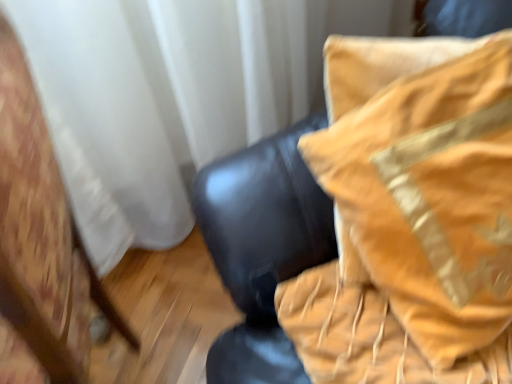
Question: Considering the relative positions of velvet gold pillow at upper right, the first furniture from the right, and wooden chair at left, placed as the 1th furniture when sorted from left to right, in the image provided, is velvet gold pillow at upper right, the first furniture from the right, to the left of wooden chair at left, placed as the 1th furniture when sorted from left to right, from the viewer's perspective?

Choices:
 (A) no
 (B) yes

Answer: (A)

Question: Is velvet gold pillow at upper right, the 2th furniture when ordered from left to right, beside wooden chair at left, placed as the 1th furniture when sorted from left to right?

Choices:
 (A) no
 (B) yes

Answer: (A)

Question: From a real-world perspective, is velvet gold pillow at upper right, the first furniture from the right, on top of wooden chair at left, placed as the 1th furniture when sorted from left to right?

Choices:
 (A) yes
 (B) no

Answer: (A)

Question: Would you say velvet gold pillow at upper right, the first furniture from the right, is outside wooden chair at left, placed as the 1th furniture when sorted from left to right?

Choices:
 (A) yes
 (B) no

Answer: (A)

Question: Is velvet gold pillow at upper right, the first furniture from the right, positioned behind wooden chair at left, which is the 2th furniture in right-to-left order?

Choices:
 (A) yes
 (B) no

Answer: (A)

Question: From a real-world perspective, is velvet gold pillow at upper right, the first furniture from the right, located beneath wooden chair at left, placed as the 1th furniture when sorted from left to right?

Choices:
 (A) yes
 (B) no

Answer: (B)

Question: Is wooden chair at left, placed as the 1th furniture when sorted from left to right, at the left side of velvet gold pillow at upper right, the 2th furniture when ordered from left to right?

Choices:
 (A) yes
 (B) no

Answer: (A)

Question: Considering the relative sizes of wooden chair at left, which is the 2th furniture in right-to-left order, and velvet gold pillow at upper right, the 2th furniture when ordered from left to right, in the image provided, is wooden chair at left, which is the 2th furniture in right-to-left order, taller than velvet gold pillow at upper right, the 2th furniture when ordered from left to right,?

Choices:
 (A) no
 (B) yes

Answer: (B)

Question: Does wooden chair at left, placed as the 1th furniture when sorted from left to right, have a lesser height compared to velvet gold pillow at upper right, the 2th furniture when ordered from left to right?

Choices:
 (A) no
 (B) yes

Answer: (A)

Question: From a real-world perspective, is wooden chair at left, which is the 2th furniture in right-to-left order, positioned over velvet gold pillow at upper right, the first furniture from the right, based on gravity?

Choices:
 (A) yes
 (B) no

Answer: (B)

Question: From a real-world perspective, is wooden chair at left, which is the 2th furniture in right-to-left order, below velvet gold pillow at upper right, the first furniture from the right?

Choices:
 (A) yes
 (B) no

Answer: (A)

Question: Is velvet gold pillow at upper right, the first furniture from the right, located within wooden chair at left, which is the 2th furniture in right-to-left order?

Choices:
 (A) yes
 (B) no

Answer: (B)

Question: Is wooden chair at left, placed as the 1th furniture when sorted from left to right, inside the boundaries of velvet gold pillow at upper right, the 2th furniture when ordered from left to right, or outside?

Choices:
 (A) outside
 (B) inside

Answer: (A)